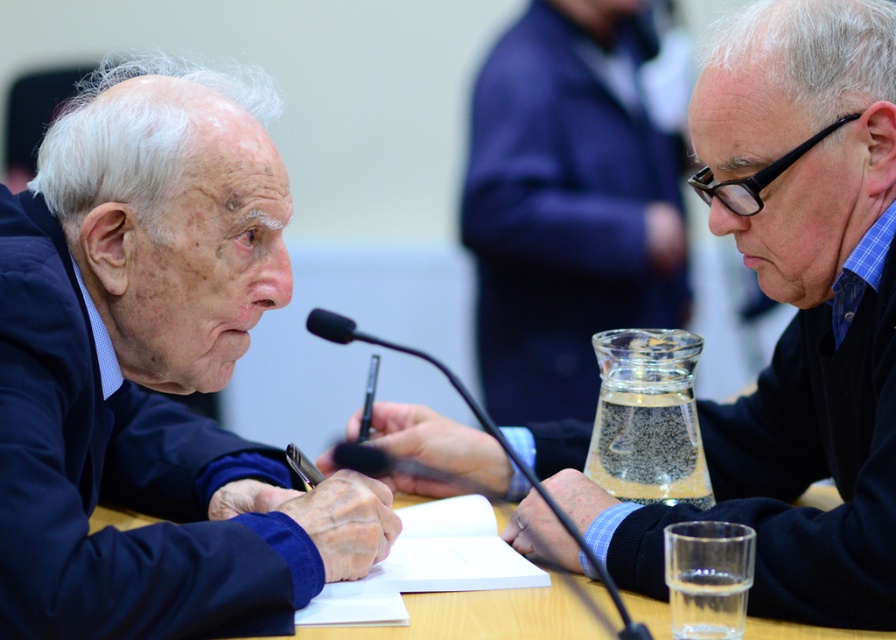
You are a photographer trying to capture a closeup of the matte black pen at center and the wooden table at center. Which object will appear larger in your photo?

The matte black pen at center will appear larger in the photo because it is closer to the viewer than the wooden table at center.

You are a participant in the meeting and need to reach for the matte black pen at center. Based on the coordinates provided, can you estimate its position relative to the table?

The matte black pen at center is located at coordinates point (791, 321), which would place it near the center of the table, slightly closer to the right edge.